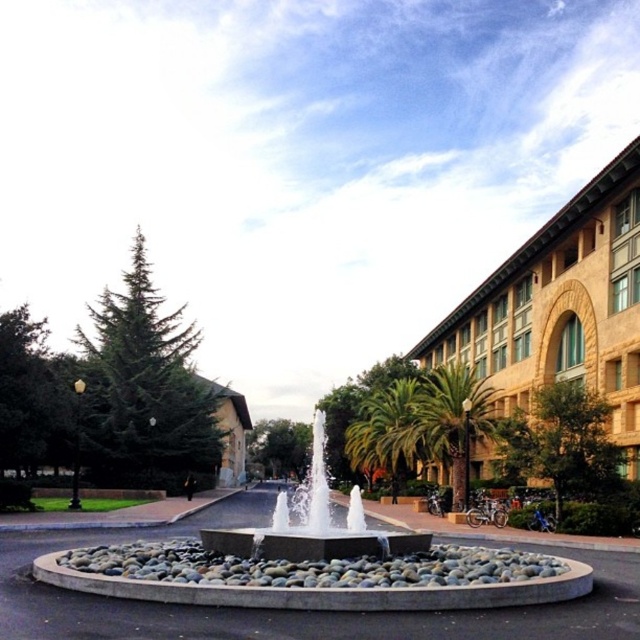
Question: Which object appears farthest from the camera in this image?

Choices:
 (A) green leafy palm tree at center-right
 (B) polished stone fountain at center
 (C) gray concrete fountain at center
 (D) green leafy palm tree at center

Answer: (D)

Question: Which object appears farthest from the camera in this image?

Choices:
 (A) green leafy palm tree at center-right
 (B) green leafy palm tree at center
 (C) gray concrete fountain at center

Answer: (B)

Question: Does polished stone fountain at center have a lesser width compared to green leafy palm tree at center-right?

Choices:
 (A) no
 (B) yes

Answer: (B)

Question: Among these objects, which one is nearest to the camera?

Choices:
 (A) polished stone fountain at center
 (B) gray concrete fountain at center
 (C) green leafy palm tree at center

Answer: (B)

Question: Is gray concrete fountain at center positioned at the back of green leafy palm tree at center-right?

Choices:
 (A) no
 (B) yes

Answer: (A)

Question: Is polished stone fountain at center to the left of green leafy palm tree at center-right from the viewer's perspective?

Choices:
 (A) yes
 (B) no

Answer: (A)